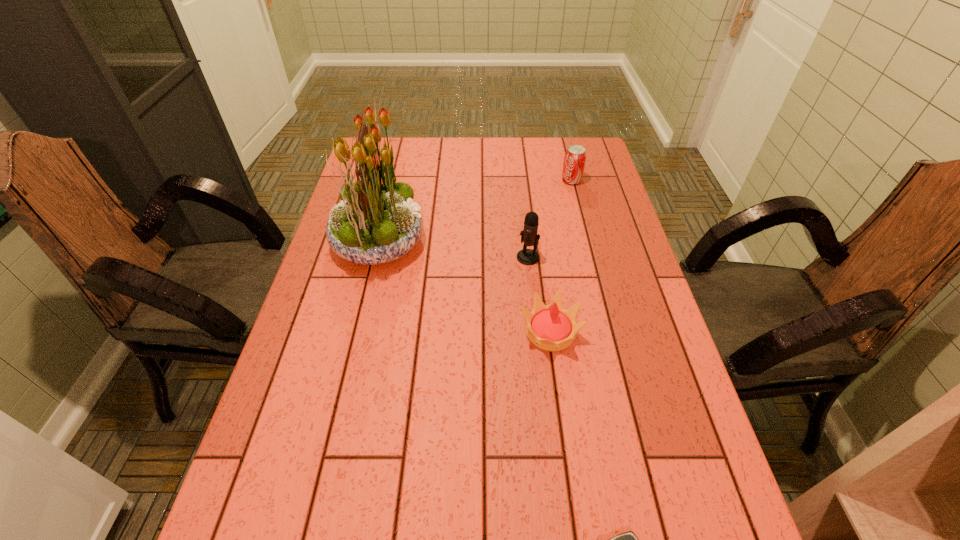
You are a GUI agent. You are given a task and a screenshot of the screen. Output one action in this format:
    pyautogui.click(x=<x>, y=<y>)
    Task: Click on the leftmost object
    
    Given the screenshot: What is the action you would take?
    click(376, 222)

Locate an element on the screen. Image resolution: width=960 pixels, height=540 pixels. flower arrangement is located at coordinates (376, 222).

Find the location of `microphone`. microphone is located at coordinates 529,235.

This screenshot has width=960, height=540. What are the coordinates of `the farthest object` in the screenshot? It's located at (575, 157).

This screenshot has height=540, width=960. Identify the location of the rightmost object. (575, 157).

The width and height of the screenshot is (960, 540). Find the location of `the fourth farthest object`. the fourth farthest object is located at coordinates (550, 327).

This screenshot has height=540, width=960. Identify the location of free location located on the front-facing side of the flower arrangement. (x=486, y=241).

This screenshot has height=540, width=960. Find the location of `vacant space located 0.260m on the left of the fourth shortest object`. vacant space located 0.260m on the left of the fourth shortest object is located at coordinates (425, 257).

Find the location of a particular element. Image resolution: width=960 pixels, height=540 pixels. vacant point located on the front of the rightmost object is located at coordinates (579, 210).

Identify the location of free region located on the front of the fourth farthest object. (577, 526).